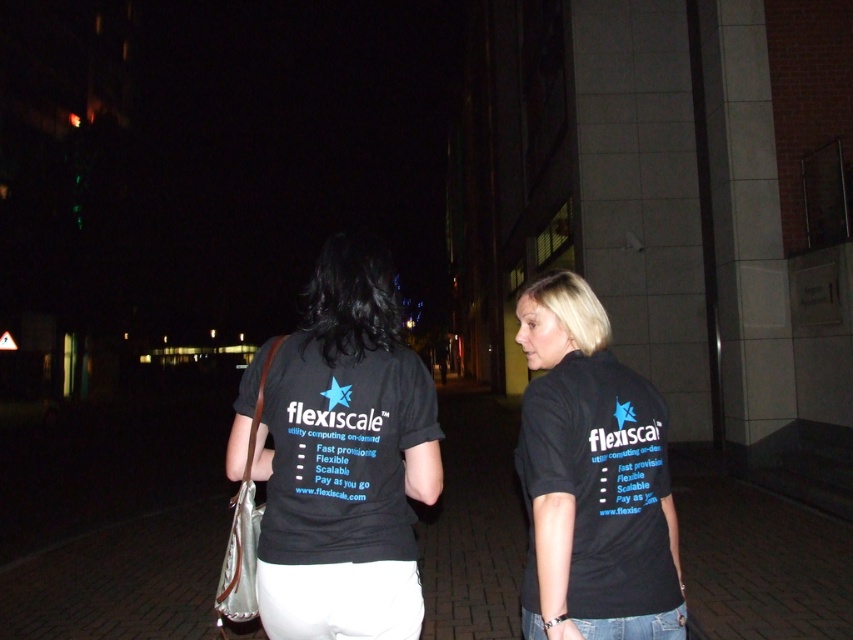
Question: Which point is closer to the camera taking this photo?

Choices:
 (A) (679, 608)
 (B) (326, 250)
 (C) (381, 344)

Answer: (A)

Question: Which of the following is the closest to the observer?

Choices:
 (A) (277, 552)
 (B) (563, 358)
 (C) (556, 289)

Answer: (A)

Question: Among these points, which one is farthest from the camera?

Choices:
 (A) (541, 442)
 (B) (250, 438)

Answer: (B)

Question: Observing the image, what is the correct spatial positioning of black fabric t-shirt at center in reference to black matte t-shirt at center?

Choices:
 (A) below
 (B) above

Answer: (B)

Question: Does black fabric t-shirt at center have a greater width compared to black fabric shirt at center?

Choices:
 (A) yes
 (B) no

Answer: (B)

Question: Does black fabric t-shirt at center appear over black fabric shirt at center?

Choices:
 (A) no
 (B) yes

Answer: (B)